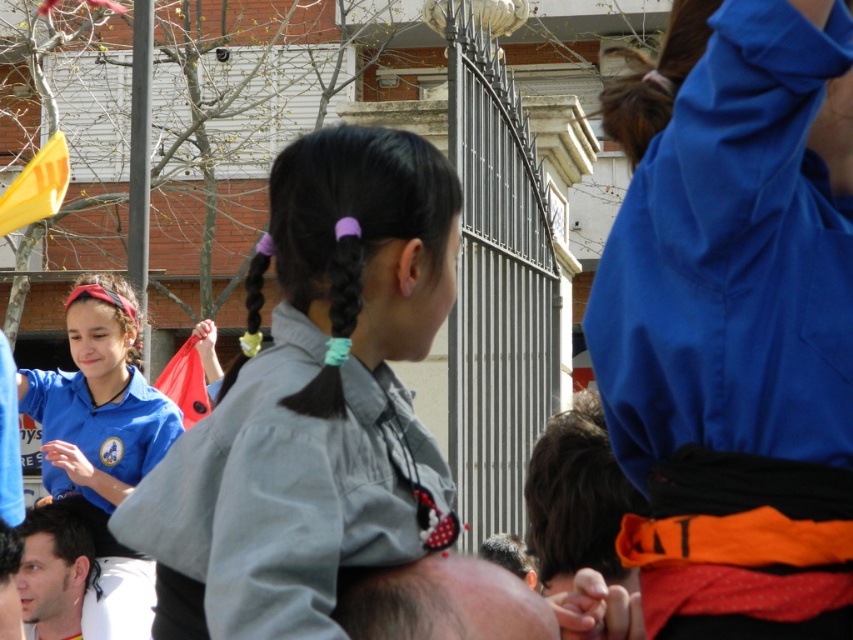
Question: Which object is the farthest from the blue fabric at upper right?

Choices:
 (A) red plastic bag at left
 (B) dark brown hair at center
 (C) silky purple hair at center

Answer: (A)

Question: Which point appears farthest from the camera in this image?

Choices:
 (A) (537, 486)
 (B) (16, 193)
 (C) (625, 134)
 (D) (77, 376)

Answer: (B)

Question: Is blue fabric shirt at left wider than red plastic bag at left?

Choices:
 (A) no
 (B) yes

Answer: (A)

Question: Is gray fabric shirt at center above red plastic bag at left?

Choices:
 (A) yes
 (B) no

Answer: (B)

Question: Does dark brown hair at center have a lesser width compared to brown silky hair at upper center?

Choices:
 (A) yes
 (B) no

Answer: (A)

Question: Which of the following is the closest to the observer?

Choices:
 (A) (71, 557)
 (B) (463, 592)

Answer: (B)